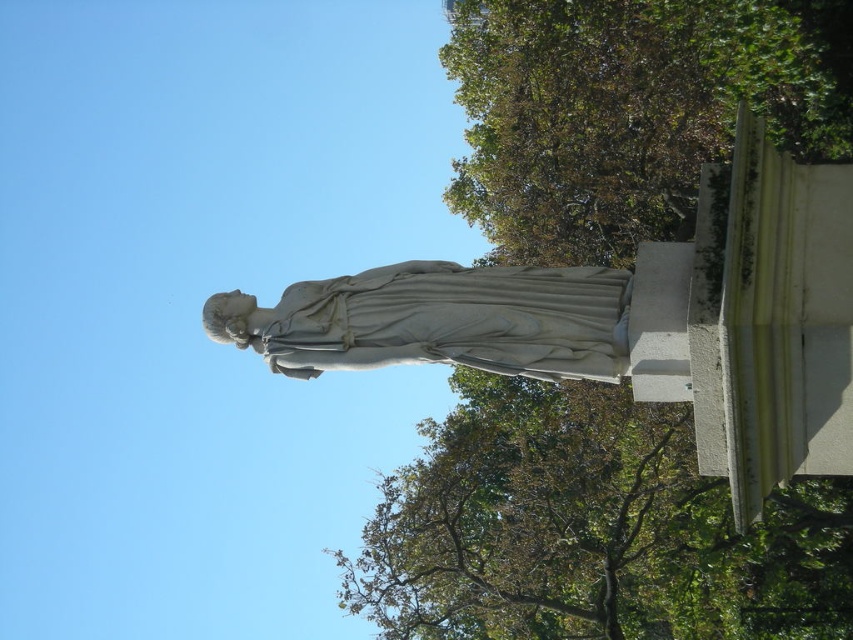
Which of these two, green leafy tree at lower center or green leafy tree at upper right, stands taller?

Standing taller between the two is green leafy tree at upper right.

Is point (381, 554) more distant than point (599, 132)?

Yes, point (381, 554) is farther from viewer.

You are a GUI agent. You are given a task and a screenshot of the screen. Output one action in this format:
    pyautogui.click(x=<x>, y=<y>)
    Task: Click on the green leafy tree at lower center
    Image resolution: width=853 pixels, height=640 pixels.
    Given the screenshot: What is the action you would take?
    pyautogui.click(x=589, y=531)

Where is `green leafy tree at lower center`? The width and height of the screenshot is (853, 640). green leafy tree at lower center is located at coordinates (589, 531).

Measure the distance between point [521,220] and camera.

The distance of point [521,220] from camera is 216.80 feet.

Which is more to the right, green leafy tree at upper right or white marble statue at center?

green leafy tree at upper right

Does point (811, 61) come closer to viewer compared to point (492, 358)?

No.

I want to click on green leafy tree at upper right, so click(x=630, y=109).

Is green leafy tree at lower center shorter than white marble statue at center?

No.

Is point (722, 515) positioned in front of point (378, 340)?

No, it is not.

Is point (503, 381) more distant than point (561, 298)?

That is True.

I want to click on green leafy tree at lower center, so [x=589, y=531].